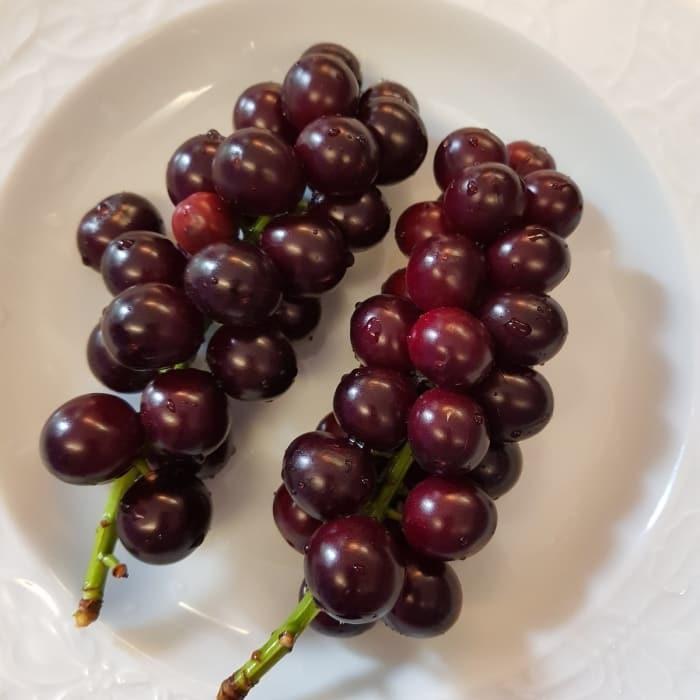
Where is `top edge of bowl`? The width and height of the screenshot is (700, 700). top edge of bowl is located at coordinates (553, 55).